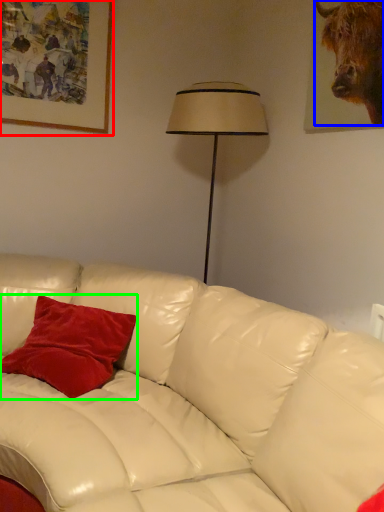
Question: Which object is positioned farthest from picture frame (highlighted by a red box)? Select from bull (highlighted by a blue box) and pillow (highlighted by a green box).

Choices:
 (A) bull
 (B) pillow

Answer: (A)